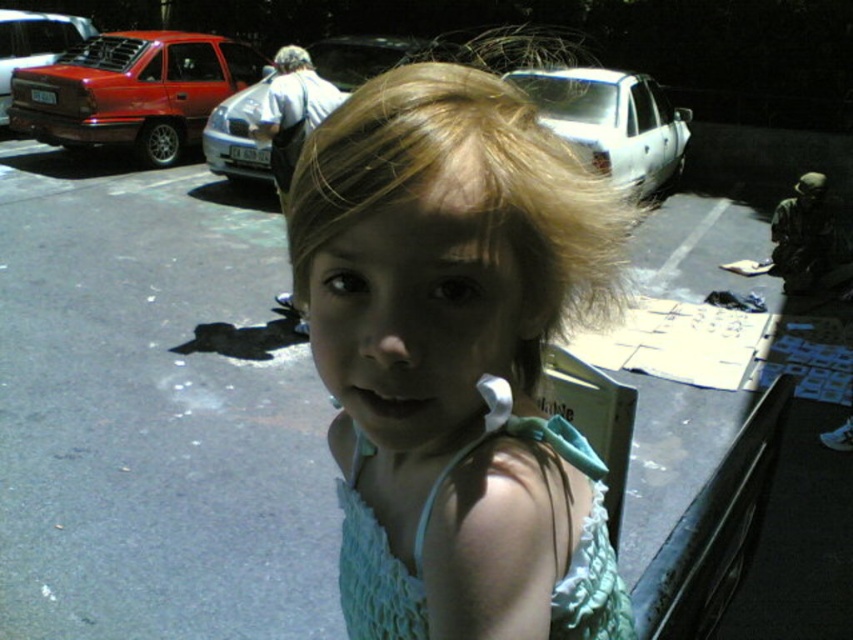
Question: Which point appears closest to the camera in this image?

Choices:
 (A) (233, 129)
 (B) (397, 49)
 (C) (140, 29)
 (D) (579, 604)

Answer: (D)

Question: Which object is the farthest from the blonde hair at upper center?

Choices:
 (A) metallic silver car at center
 (B) light blue lace dress at center
 (C) light blue fabric dress at center

Answer: (B)

Question: Is light blue fabric dress at center below metallic silver car at center?

Choices:
 (A) no
 (B) yes

Answer: (B)

Question: Can you confirm if white glossy sedan at upper center is positioned above silver metallic car at center?

Choices:
 (A) yes
 (B) no

Answer: (B)

Question: Is light blue fabric dress at center above white glossy sedan at upper center?

Choices:
 (A) no
 (B) yes

Answer: (A)

Question: Which is farther from the shiny black car at upper center?

Choices:
 (A) matte red car at upper left
 (B) light blue fabric dress at center
 (C) silver metallic car at center
 (D) metallic silver car at center

Answer: (B)